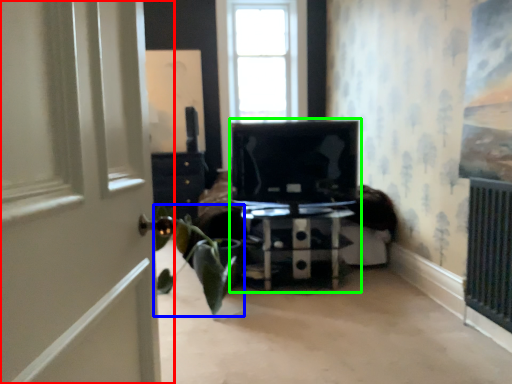
Question: Which is nearer to the door (highlighted by a red box)? houseplant (highlighted by a blue box) or entertainment center (highlighted by a green box).

Choices:
 (A) houseplant
 (B) entertainment center

Answer: (A)